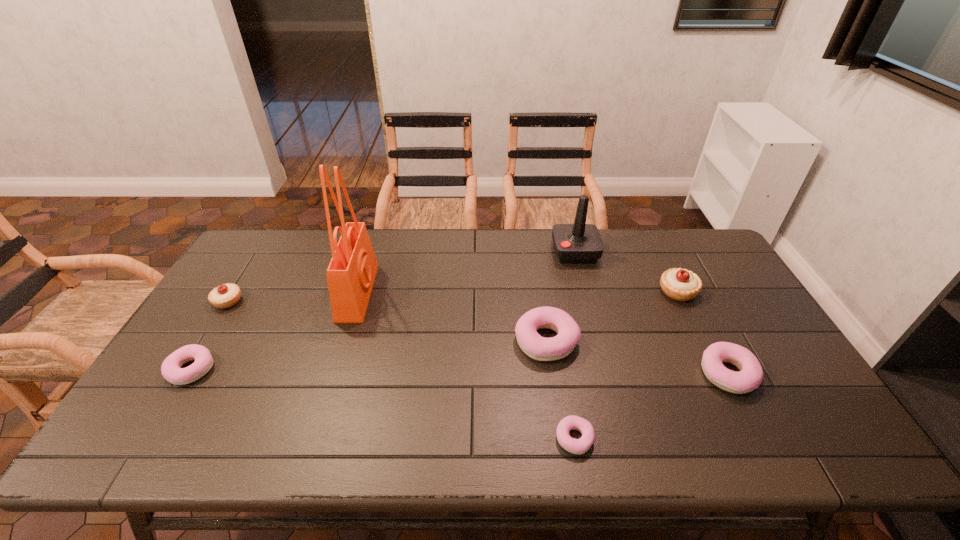
In order to click on vacant region located 0.320m on the back of the shortest pastry in this screenshot , I will do `click(554, 322)`.

You are a GUI agent. You are given a task and a screenshot of the screen. Output one action in this format:
    pyautogui.click(x=<x>, y=<y>)
    Task: Click on the tote bag positioned at the far edge
    The width and height of the screenshot is (960, 540).
    Given the screenshot: What is the action you would take?
    pyautogui.click(x=351, y=273)

Image resolution: width=960 pixels, height=540 pixels. Identify the location of joystick at the far edge. (574, 243).

At what (x,y) coordinates should I click in order to perform the action: click on object that is at the near edge. Please return your answer as a coordinate pair (x, y). The image size is (960, 540). Looking at the image, I should click on (576, 446).

Where is `vacant space at the far edge of the desktop`? vacant space at the far edge of the desktop is located at coordinates (526, 259).

In the image, there is a desktop. At what (x,y) coordinates should I click in order to perform the action: click on vacant space at the near edge. Please return your answer as a coordinate pair (x, y). Looking at the image, I should click on (708, 453).

The height and width of the screenshot is (540, 960). In the image, there is a desktop. In order to click on vacant space at the right edge in this screenshot , I will do `click(803, 392)`.

The image size is (960, 540). Identify the location of free space at the far left corner of the desktop. (275, 231).

Identify the location of free space at the far right corner of the desktop. (692, 241).

At what (x,y) coordinates should I click in order to perform the action: click on empty space that is in between the tote bag and the sixth shortest object. Please return your answer as a coordinate pair (x, y). The height and width of the screenshot is (540, 960). Looking at the image, I should click on (517, 292).